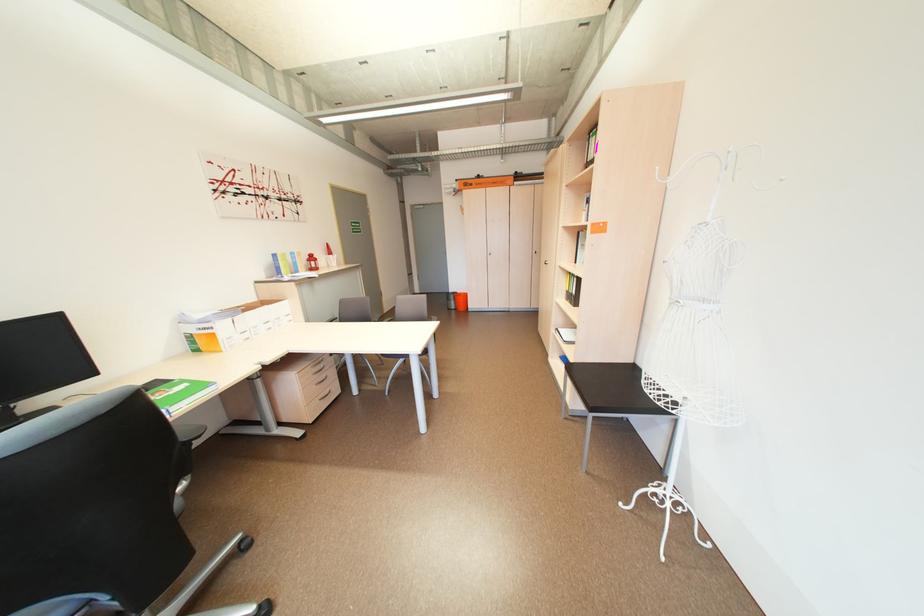
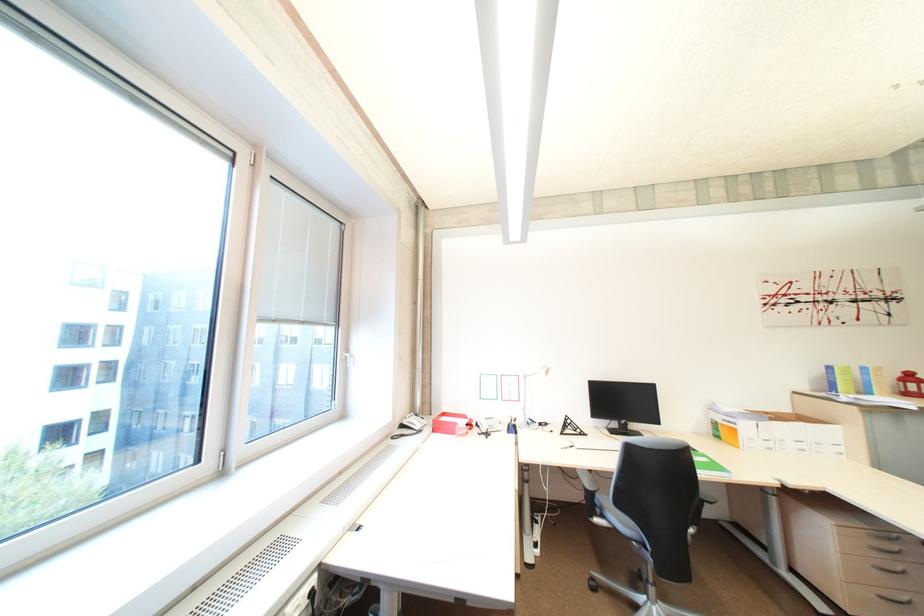
Locate, in the second image, the point that corresponds to point 223,334 in the first image.

(745, 431)